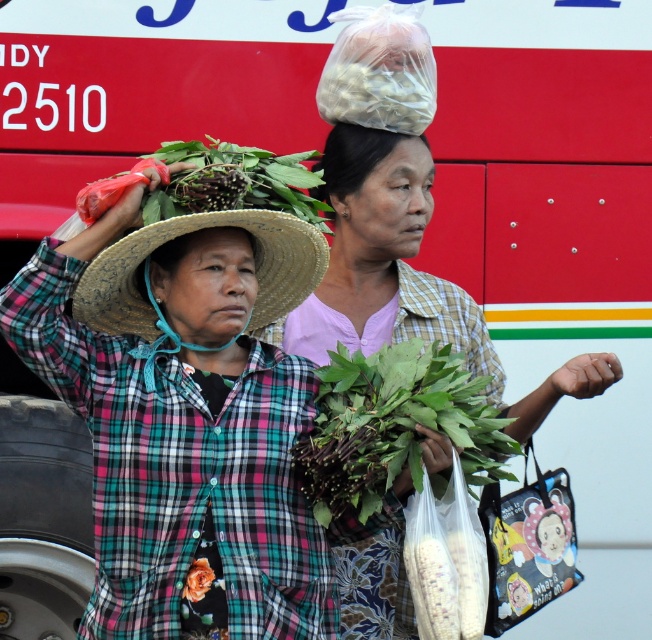
Question: Is green leafy bundle at center above green leafy plant at center?

Choices:
 (A) yes
 (B) no

Answer: (A)

Question: Which object appears closest to the camera in this image?

Choices:
 (A) orange fabric flower at lower left
 (B) straw hat at center
 (C) green leafy plant at center

Answer: (C)

Question: Which of the following is the farthest from the observer?

Choices:
 (A) (383, 298)
 (B) (226, 266)
 (C) (299, 259)
 (D) (372, 141)

Answer: (A)

Question: Which point is farther to the camera?

Choices:
 (A) click(x=126, y=298)
 (B) click(x=224, y=259)
 (C) click(x=211, y=570)

Answer: (A)

Question: Can you confirm if natural straw hat at left is positioned to the left of orange fabric flower at lower left?

Choices:
 (A) yes
 (B) no

Answer: (A)

Question: Does green leafy bundle at center appear over orange fabric flower at lower left?

Choices:
 (A) no
 (B) yes

Answer: (B)